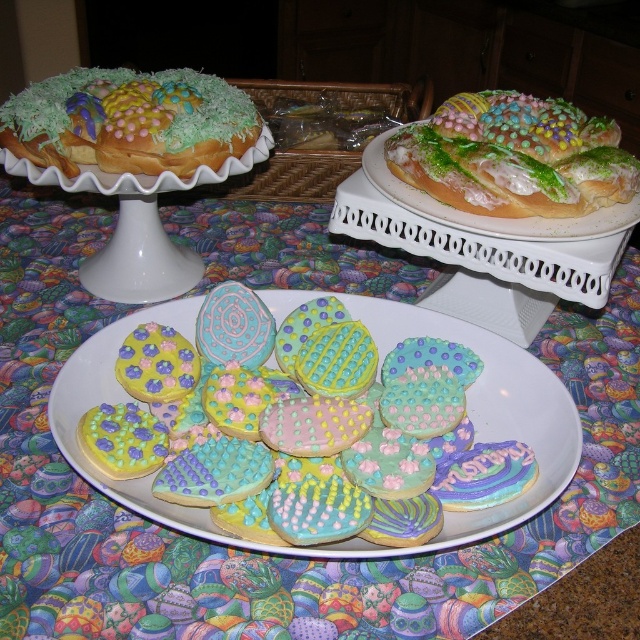
Question: Is pastel frosted pastry at center to the left of pastel frosted cake at upper left from the viewer's perspective?

Choices:
 (A) yes
 (B) no

Answer: (B)

Question: Considering the relative positions of egg-patterned fabric at center and pastel frosted cake at upper left in the image provided, where is egg-patterned fabric at center located with respect to pastel frosted cake at upper left?

Choices:
 (A) above
 (B) below

Answer: (B)

Question: Which of the following is the closest to the observer?

Choices:
 (A) pastel frosted cake at upper left
 (B) egg-patterned fabric at center
 (C) pastel frosted pastry at center
 (D) matte sugar cookies at center

Answer: (D)

Question: Among these objects, which one is nearest to the camera?

Choices:
 (A) egg-patterned fabric at center
 (B) pastel frosted cake at upper left
 (C) matte sugar cookies at center
 (D) pastel frosted pastry at center

Answer: (C)

Question: Which object is closer to the camera taking this photo?

Choices:
 (A) pastel frosted cake at upper left
 (B) matte sugar cookies at center
 (C) pastel frosted pastry at center

Answer: (B)

Question: Can you confirm if egg-patterned fabric at center is thinner than pastel frosted cake at upper left?

Choices:
 (A) yes
 (B) no

Answer: (B)